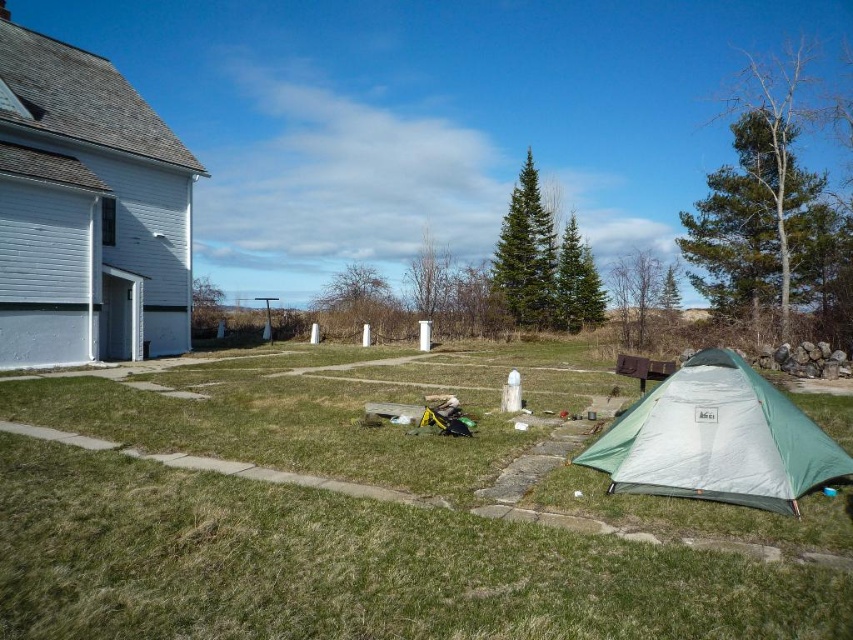
Is green grass at lower left wider than white painted wood house at left?

Indeed, green grass at lower left has a greater width compared to white painted wood house at left.

Is green grass at lower left taller than white painted wood house at left?

No, green grass at lower left is not taller than white painted wood house at left.

Between point (380, 378) and point (117, 323), which one is positioned behind?

The point (117, 323) is behind.

I want to click on green grass at lower left, so click(373, 513).

Can you confirm if green grass at lower left is wider than green fabric tent at lower right?

Yes, green grass at lower left is wider than green fabric tent at lower right.

Which is in front, point (244, 412) or point (769, 388)?

Point (769, 388) is in front.

Where is `green grass at lower left`? green grass at lower left is located at coordinates (373, 513).

Between white painted wood house at left and green fabric tent at lower right, which one has less height?

With less height is green fabric tent at lower right.

Who is more forward, (1, 172) or (694, 472)?

Positioned in front is point (694, 472).

Locate an element on the screen. The height and width of the screenshot is (640, 853). white painted wood house at left is located at coordinates (86, 211).